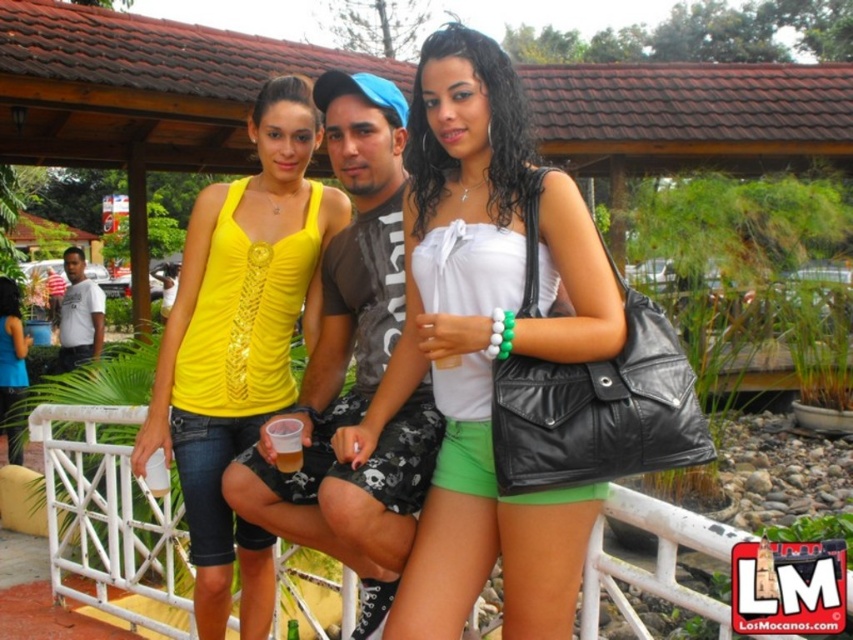
You are trying to locate the white matte tank top at center in the image. Based on the coordinates provided, where exactly would you find it?

The white matte tank top at center is located at point coordinates of 0.539 in the x axis and 0.570 in the y axis.

You are a photographer trying to capture a group photo of the white matte tank top at center and the white cotton shirt at left. If you want to ensure both subjects are fully visible in the frame, which subject should you position closer to the camera to avoid cropping?

The white cotton shirt at left should be positioned closer to the camera because the white matte tank top at center might be wider than the white cotton shirt at left, so moving the narrower one forward ensures both fit within the frame.